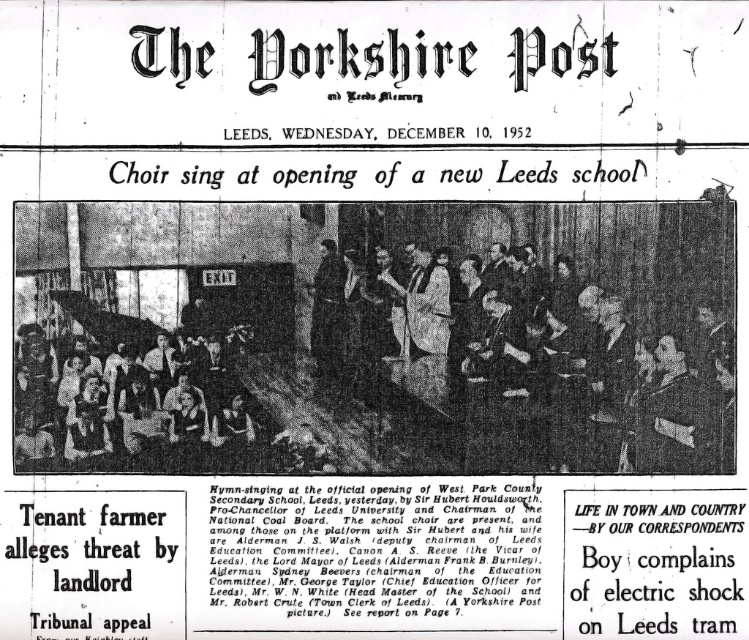
Question: From the image, what is the correct spatial relationship of dark suit coat at center in relation to matte black dress at lower left?

Choices:
 (A) below
 (B) above

Answer: (B)

Question: Which point is closer to the camera taking this photo?

Choices:
 (A) tap(618, 298)
 (B) tap(139, 336)

Answer: (B)

Question: Which point is closer to the camera?

Choices:
 (A) matte black dress at lower left
 (B) dark suit coat at center

Answer: (A)

Question: Which object appears closest to the camera in this image?

Choices:
 (A) matte black dress at lower left
 (B) dark suit coat at center

Answer: (A)

Question: Does dark suit coat at center appear over matte black dress at lower left?

Choices:
 (A) no
 (B) yes

Answer: (B)

Question: In this image, where is dark suit coat at center located relative to matte black dress at lower left?

Choices:
 (A) above
 (B) below

Answer: (A)